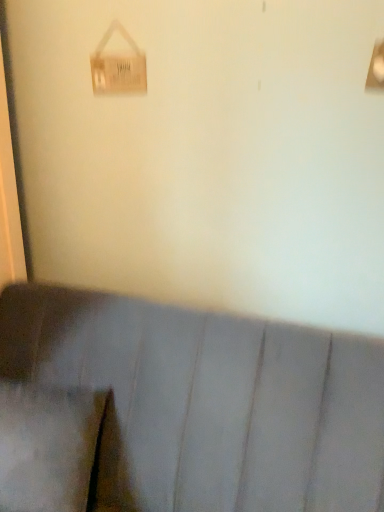
Question: In the image, is wooden sign at upper left on the left side or the right side of suede-like gray pillow at lower left?

Choices:
 (A) left
 (B) right

Answer: (B)

Question: Is point (119, 79) positioned closer to the camera than point (41, 507)?

Choices:
 (A) farther
 (B) closer

Answer: (A)

Question: Considering the real-world distances, which object is farthest from the suede-like gray pillow at lower left?

Choices:
 (A) wooden sign at upper left
 (B) suede-like gray couch at lower center

Answer: (A)

Question: Which of these objects is positioned farthest from the suede-like gray pillow at lower left?

Choices:
 (A) wooden sign at upper left
 (B) suede-like gray couch at lower center

Answer: (A)